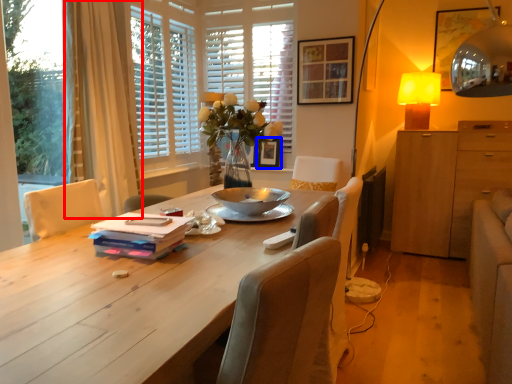
Question: Which object appears closest to the camera in this image, curtain (highlighted by a red box) or picture frame (highlighted by a blue box)?

Choices:
 (A) curtain
 (B) picture frame

Answer: (A)